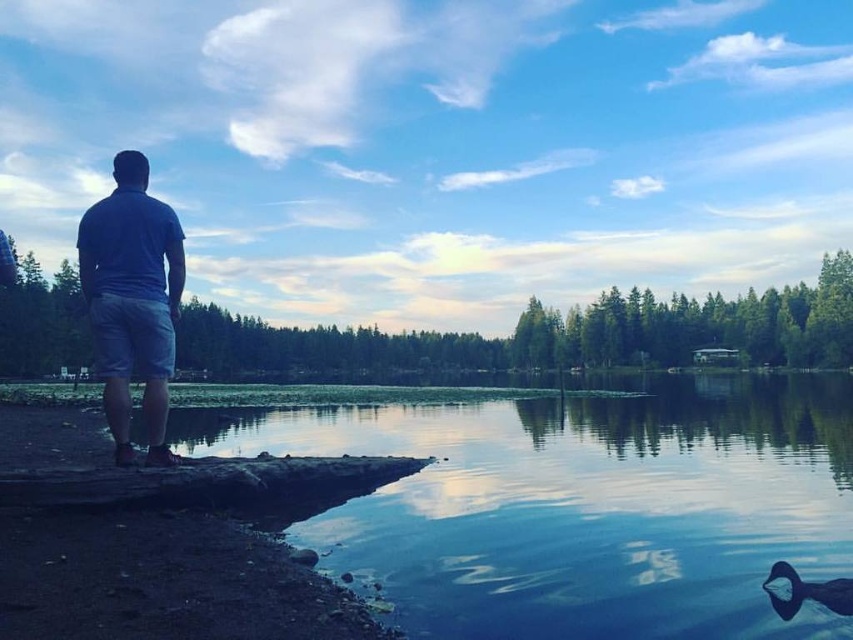
Consider the image. You are a photographer trying to capture the blue cotton shirt at left and the blue glossy duck at lower right in the same frame. Which object should you focus on first to ensure both are in focus?

You should focus on the blue cotton shirt at left first because it is positioned over the blue glossy duck at lower right, meaning it is closer to the camera. By focusing on the closer object, both will be in focus if they are within the depth of field.